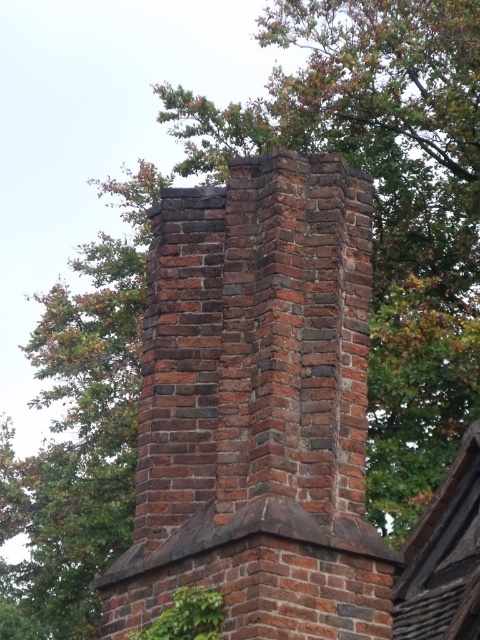
You are standing at a safe distance from the red brick chimney at center. If you want to take a photo of it without any distortion, considering the camera lens you have can focus clearly up to 30 meters, will you need to move closer or farther away?

The distance between you and the red brick chimney at center is 34.17 meters, which is beyond the camera lens focus range of 30 meters. Therefore, you need to move closer to ensure clear focus.

You are a construction worker inspecting the chimney. You need to locate the brown shingles at upper center. What are their coordinates?

The brown shingles at upper center are located at coordinates point (444,556).